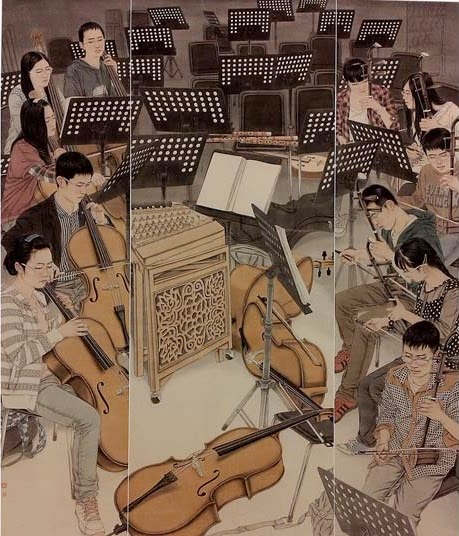
Where is `chair`? Image resolution: width=459 pixels, height=536 pixels. chair is located at coordinates (307, 437).